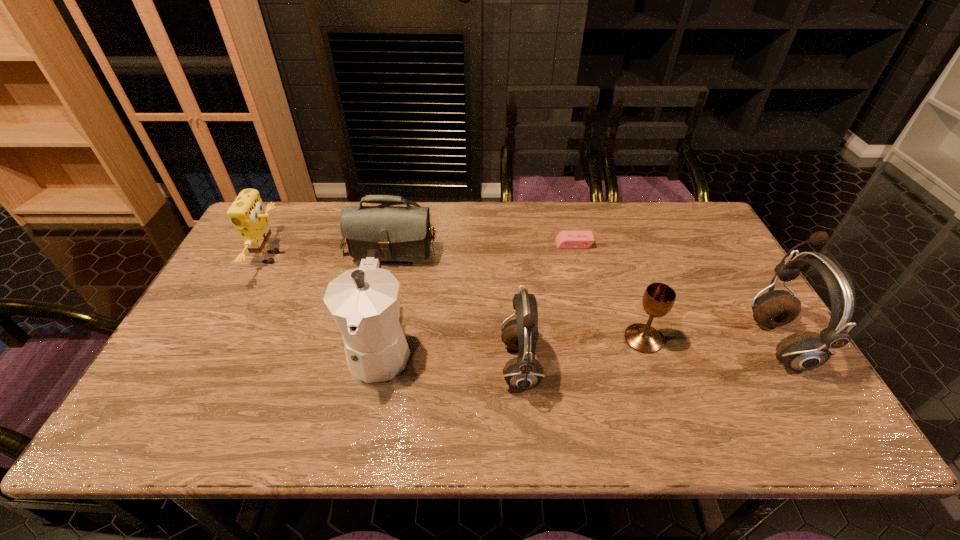
At what (x,y) coordinates should I click in order to perform the action: click on sponge at the far edge. Please return your answer as a coordinate pair (x, y). Looking at the image, I should click on (246, 213).

Image resolution: width=960 pixels, height=540 pixels. I want to click on eraser that is positioned at the far edge, so click(565, 239).

Find the location of a particular element. This screenshot has width=960, height=540. coffeepot at the near edge is located at coordinates (364, 302).

Image resolution: width=960 pixels, height=540 pixels. In order to click on object that is at the left edge in this screenshot , I will do 246,213.

The width and height of the screenshot is (960, 540). What are the coordinates of `object located at the right edge` in the screenshot? It's located at (807, 350).

I want to click on object that is at the far left corner, so click(x=246, y=213).

Find the location of a particular element. object present at the near right corner is located at coordinates (807, 350).

In the image, there is a desktop. At what (x,y) coordinates should I click in order to perform the action: click on vacant space at the far edge. Please return your answer as a coordinate pair (x, y). This screenshot has height=540, width=960. Looking at the image, I should click on (513, 234).

In the image, there is a desktop. Identify the location of vacant space at the near edge. (306, 374).

Identify the location of blank area at the left edge. (245, 279).